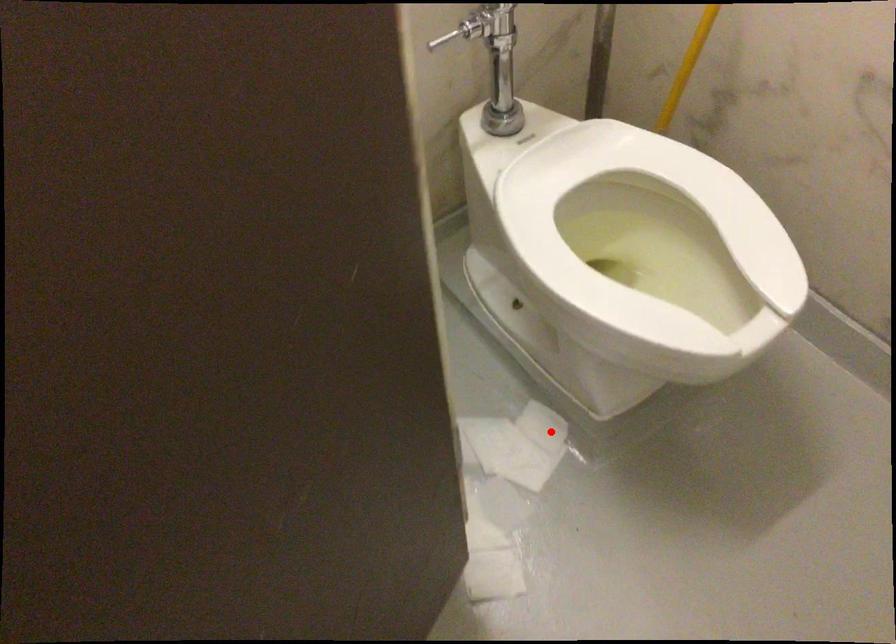
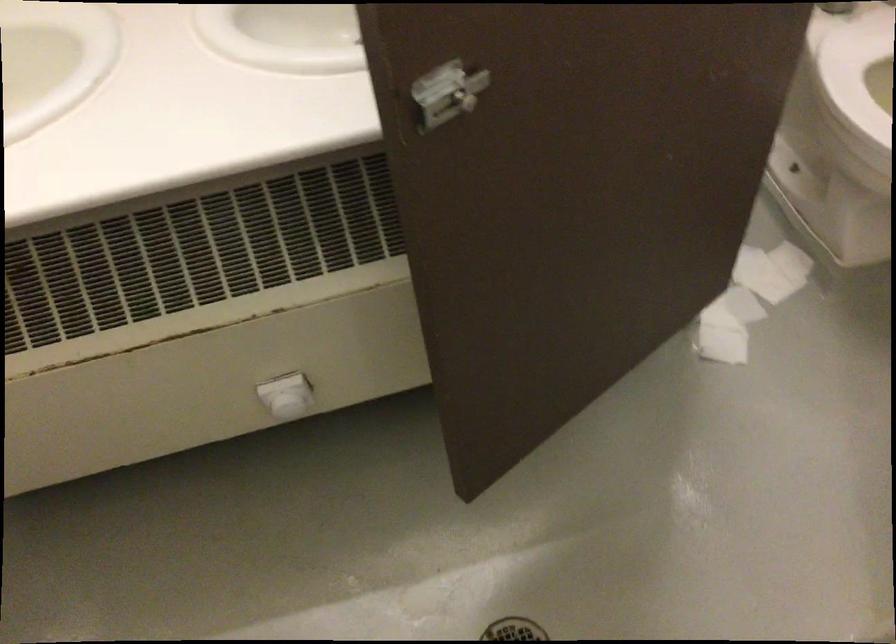
Where in the second image is the point corresponding to the highlighted location from the first image?

(790, 261)